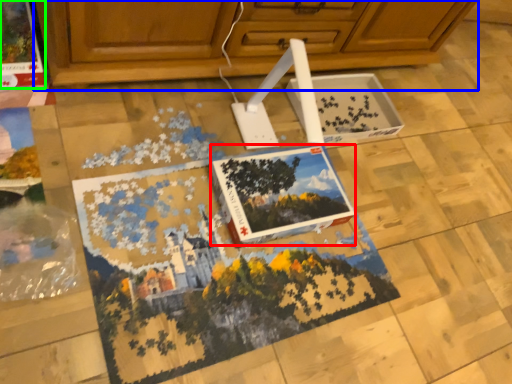
Question: Which object is the farthest from magazine (highlighted by a red box)? Choose among these: cabinetry (highlighted by a blue box) or magazine (highlighted by a green box).

Choices:
 (A) cabinetry
 (B) magazine

Answer: (B)